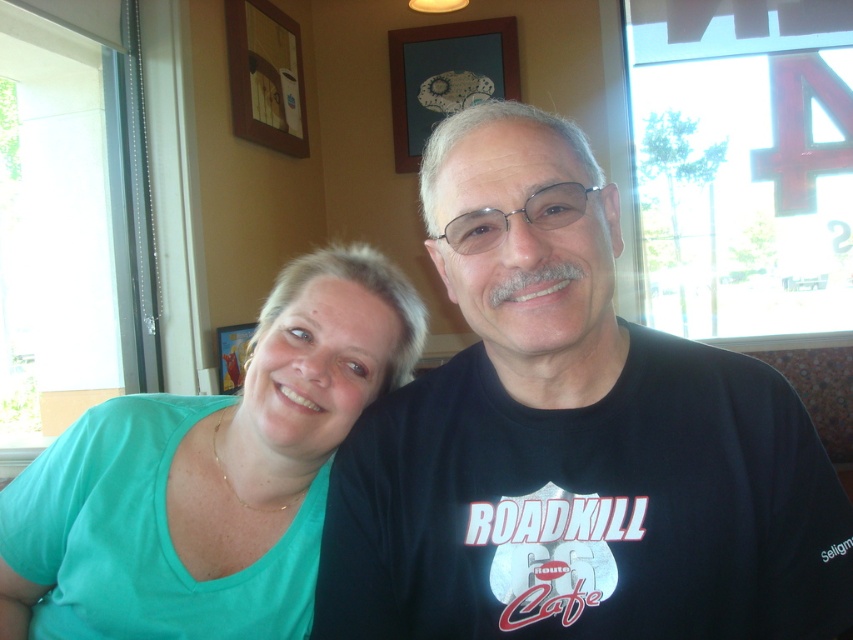
You are taking a photo of two people sitting at a table. The camera is positioned at a certain distance. There is a point at coordinates point (669, 518). Is this point closer to the camera than 30 inches?

The point (669, 518) is 25.14 inches from the camera, so yes, it is closer than 30 inches.